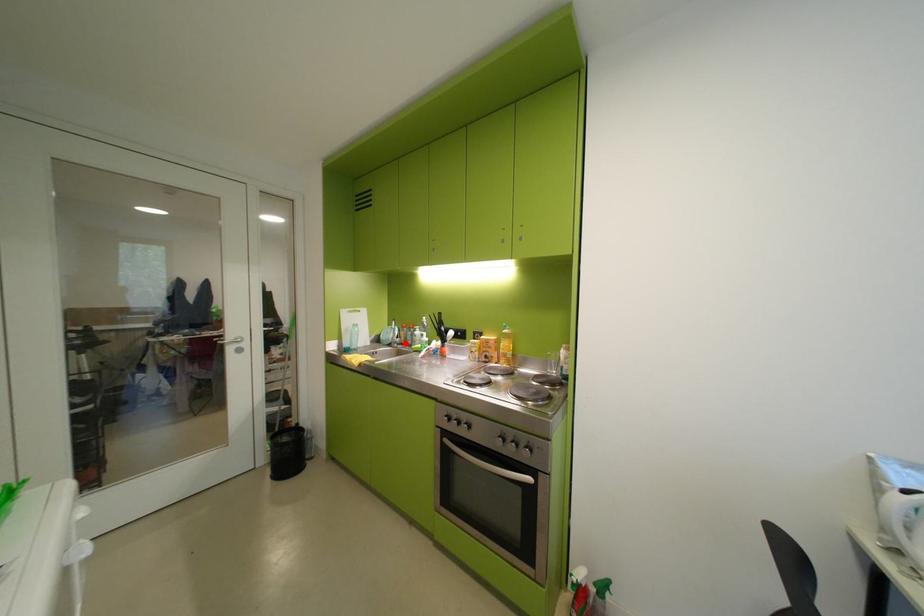
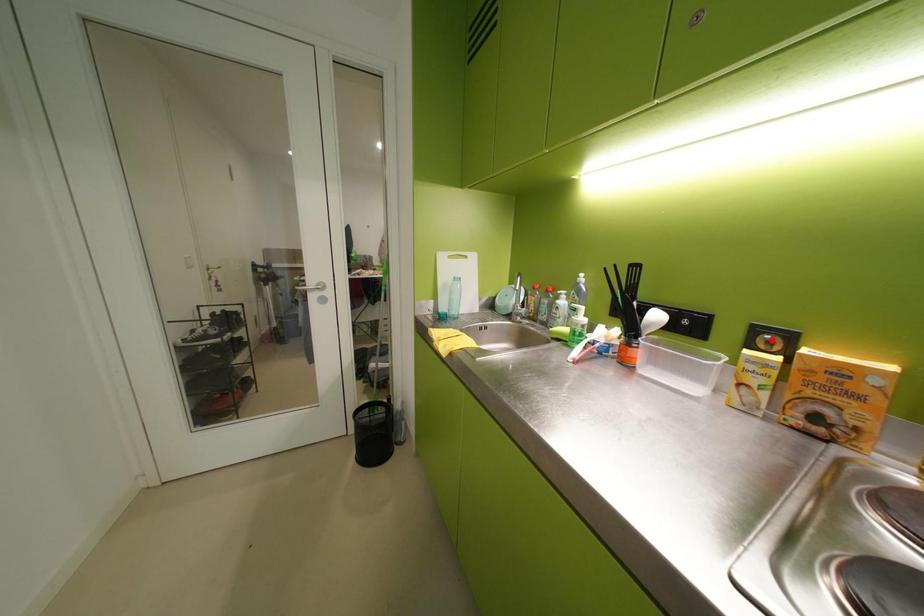
I am providing you with two images of the same scene from different viewpoints. A red point is marked on the first image and another point is marked on the second image. Is the red point in image1 aligned with the point shown in image2?

No